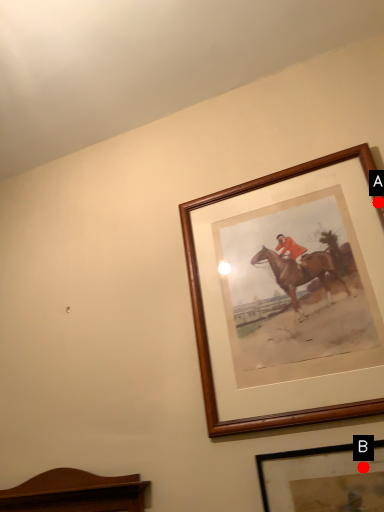
Question: Two points are circled on the image, labeled by A and B beside each circle. Which of the following is the farthest from the observer?

Choices:
 (A) A is further
 (B) B is further

Answer: (A)